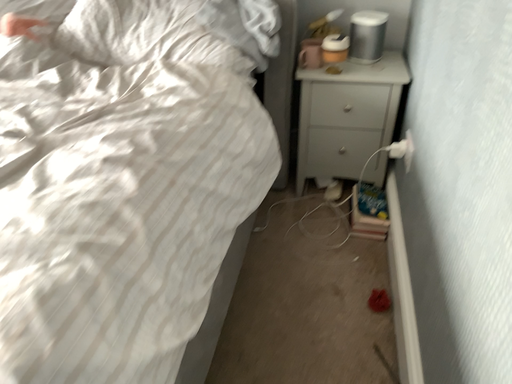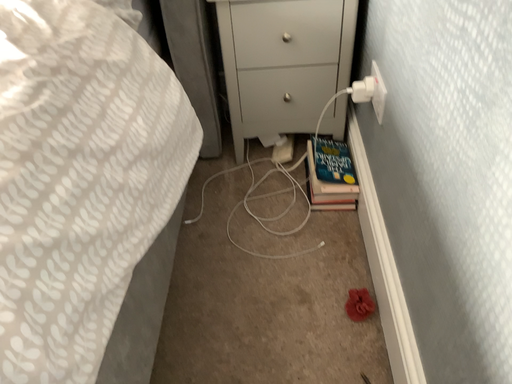
Question: How did the camera likely rotate when shooting the video?

Choices:
 (A) rotated downward
 (B) rotated upward

Answer: (A)